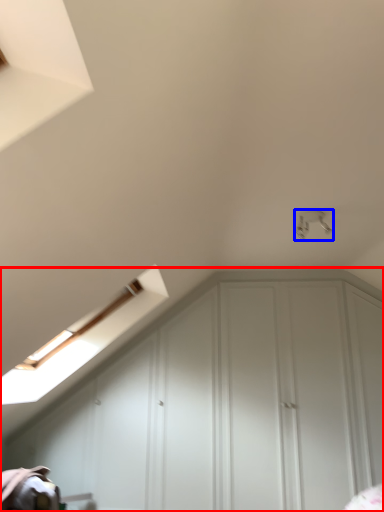
Question: Which object is further to the camera taking this photo, dresser (highlighted by a red box) or light fixture (highlighted by a blue box)?

Choices:
 (A) dresser
 (B) light fixture

Answer: (A)